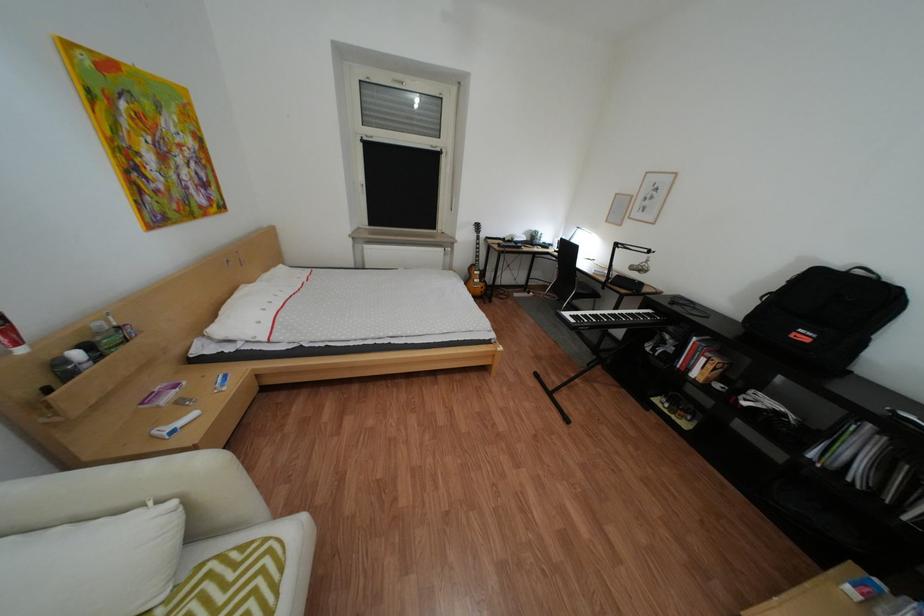
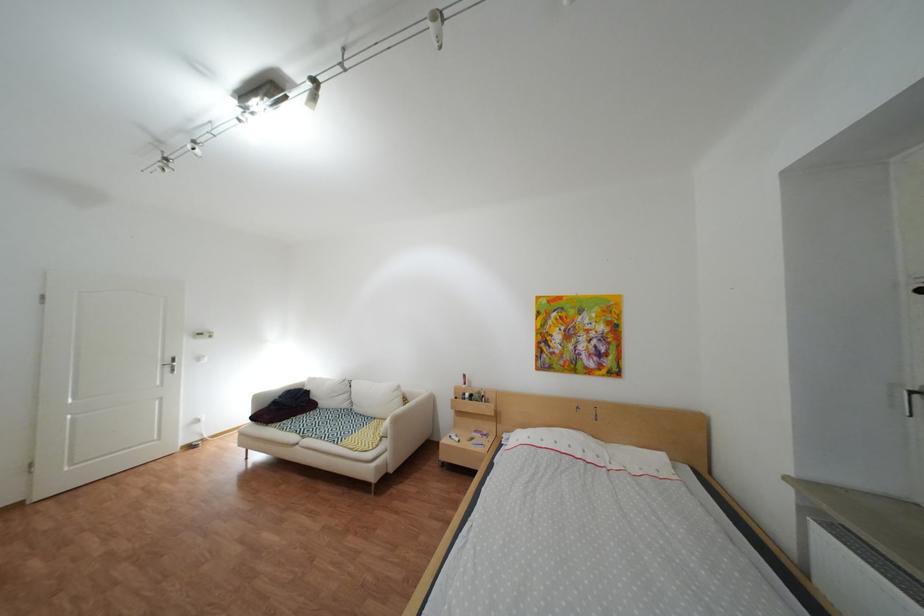
Find the pixel in the second image that matches point (78, 363) in the first image.

(480, 395)